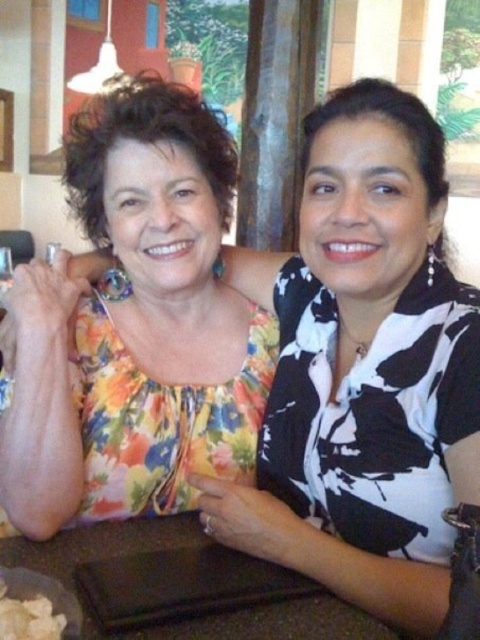
Question: Can you confirm if floral fabric blouse at upper left is bigger than black matte table at lower center?

Choices:
 (A) no
 (B) yes

Answer: (B)

Question: Which object is closer to the camera taking this photo?

Choices:
 (A) black matte table at lower center
 (B) white creamy food at lower left

Answer: (B)

Question: Does floral fabric blouse at upper left have a smaller size compared to white creamy food at lower left?

Choices:
 (A) yes
 (B) no

Answer: (B)

Question: Does floral fabric blouse at upper left appear on the left side of white creamy food at lower left?

Choices:
 (A) yes
 (B) no

Answer: (B)

Question: Which point appears farthest from the camera in this image?

Choices:
 (A) (4, 572)
 (B) (216, 260)

Answer: (B)

Question: Which is nearer to the floral fabric blouse at upper left?

Choices:
 (A) white creamy food at lower left
 (B) black matte table at lower center

Answer: (B)